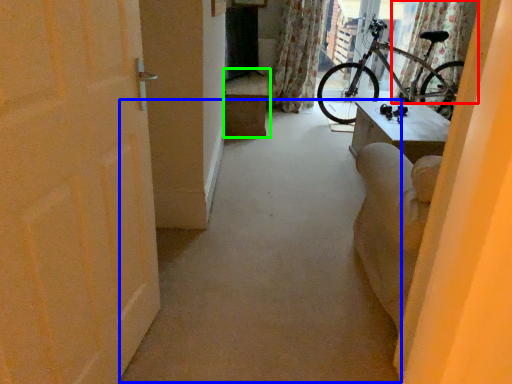
Question: Which object is the farthest from curtain (highlighted by a red box)? Choose among these: alley (highlighted by a blue box) or furniture (highlighted by a green box).

Choices:
 (A) alley
 (B) furniture

Answer: (A)